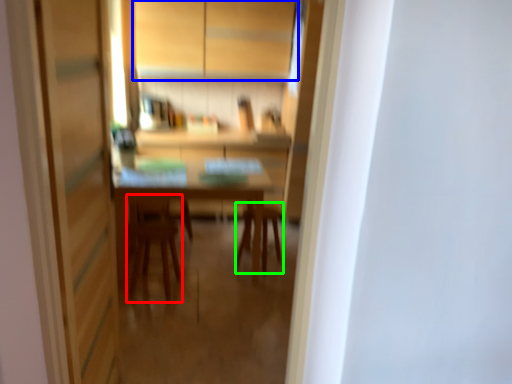
Question: Based on their relative distances, which object is farther from armchair (highlighted by a red box)? Choose from cabinetry (highlighted by a blue box) and chair (highlighted by a green box).

Choices:
 (A) cabinetry
 (B) chair

Answer: (A)